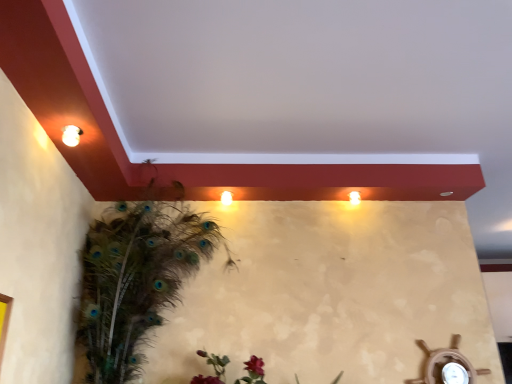
What do you see at coordinates (71, 135) in the screenshot? The height and width of the screenshot is (384, 512). I see `matte white light fixture at upper left` at bounding box center [71, 135].

Locate an element on the screen. feathered peacock at left is located at coordinates (137, 278).

Identify the location of matte white light at upper right. The height and width of the screenshot is (384, 512). (355, 197).

Considering the relative sizes of matte white light at upper right and feathered peacock at left in the image provided, is matte white light at upper right wider than feathered peacock at left?

No, matte white light at upper right is not wider than feathered peacock at left.

From the image's perspective, which object appears higher, matte white light at upper right or feathered peacock at left?

matte white light at upper right appears higher in the image.

Is matte white light at upper right aimed at feathered peacock at left?

No, matte white light at upper right does not turn towards feathered peacock at left.

Does matte white light at upper right touch feathered peacock at left?

There is a gap between matte white light at upper right and feathered peacock at left.

From the image's perspective, which one is positioned lower, feathered peacock at left or matte white light at upper right?

feathered peacock at left.

Does feathered peacock at left turn towards matte white light at upper right?

No, feathered peacock at left is not oriented towards matte white light at upper right.

In the scene shown: Can you confirm if feathered peacock at left is shorter than matte white light at upper right?

No.

From a real-world perspective, is feathered peacock at left positioned over matte white light at upper right based on gravity?

No, from a real-world perspective, feathered peacock at left is not above matte white light at upper right.

Between matte white light at upper right and matte white light fixture at upper left, which one appears on the right side from the viewer's perspective?

matte white light at upper right.

Is matte white light at upper right positioned far away from matte white light fixture at upper left?

Indeed, matte white light at upper right is not near matte white light fixture at upper left.

The width and height of the screenshot is (512, 384). Identify the location of light fixture located on the left of matte white light at upper right. (71, 135).

From their relative heights in the image, would you say matte white light at upper right is taller or shorter than matte white light fixture at upper left?

In the image, matte white light at upper right appears to be taller than matte white light fixture at upper left.

In the image, is matte white light fixture at upper left positioned in front of or behind matte white light at upper right?

matte white light fixture at upper left is positioned closer to the viewer than matte white light at upper right.

Would you say matte white light at upper right is part of matte white light fixture at upper left's contents?

No, matte white light fixture at upper left does not contain matte white light at upper right.

Locate an element on the screen. light below the matte white light fixture at upper left (from a real-world perspective) is located at coordinates (355, 197).

Is matte white light fixture at upper left not near matte white light at upper right?

matte white light fixture at upper left is far away from matte white light at upper right.

Considering the relative positions of matte white light fixture at upper left and feathered peacock at left in the image provided, is matte white light fixture at upper left behind feathered peacock at left?

No, the depth of matte white light fixture at upper left is less than that of feathered peacock at left.

Is point (70, 142) farther from viewer compared to point (97, 294)?

No, it is in front of (97, 294).

Could you tell me if matte white light fixture at upper left is facing feathered peacock at left?

No, matte white light fixture at upper left is not facing towards feathered peacock at left.

Considering the sizes of objects matte white light fixture at upper left and feathered peacock at left in the image provided, who is bigger, matte white light fixture at upper left or feathered peacock at left?

Bigger between the two is feathered peacock at left.

Is feathered peacock at left wider or thinner than matte white light fixture at upper left?

Clearly, feathered peacock at left has more width compared to matte white light fixture at upper left.

Who is smaller, feathered peacock at left or matte white light fixture at upper left?

Smaller between the two is matte white light fixture at upper left.

In the scene shown: Which is less distant, (180, 213) or (70, 129)?

Point (180, 213).

Is feathered peacock at left positioned far away from matte white light fixture at upper left?

feathered peacock at left is near matte white light fixture at upper left, not far away.

In order to click on bird that is under the matte white light at upper right (from a real-world perspective) in this screenshot , I will do `click(137, 278)`.

Find the location of a particular element. This screenshot has height=384, width=512. bird in front of the matte white light at upper right is located at coordinates (137, 278).

From the image, which object appears to be nearer to matte white light at upper right, feathered peacock at left or matte white light fixture at upper left?

Based on the image, feathered peacock at left appears to be nearer to matte white light at upper right.

From the picture: Estimate the real-world distances between objects in this image. Which object is closer to matte white light fixture at upper left, feathered peacock at left or matte white light at upper right?

feathered peacock at left is positioned closer to the anchor matte white light fixture at upper left.

Which object lies nearer to the anchor point matte white light fixture at upper left, matte white light at upper right or feathered peacock at left?

feathered peacock at left is positioned closer to the anchor matte white light fixture at upper left.

Looking at the image, which one is located closer to feathered peacock at left, matte white light fixture at upper left or matte white light at upper right?

The object closer to feathered peacock at left is matte white light fixture at upper left.

From the image, which object appears to be farther from matte white light at upper right, matte white light fixture at upper left or feathered peacock at left?

Based on the image, matte white light fixture at upper left appears to be further to matte white light at upper right.

Based on their spatial positions, is matte white light at upper right or matte white light fixture at upper left closer to feathered peacock at left?

Among the two, matte white light fixture at upper left is located nearer to feathered peacock at left.

Locate an element on the screen. The width and height of the screenshot is (512, 384). bird between matte white light fixture at upper left and matte white light at upper right is located at coordinates (137, 278).